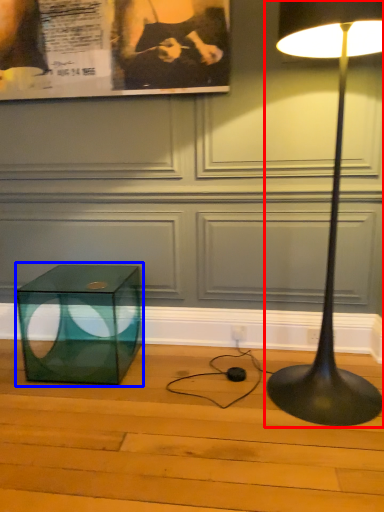
Question: Which of the following is the closest to the observer, lamp (highlighted by a red box) or table (highlighted by a blue box)?

Choices:
 (A) lamp
 (B) table

Answer: (A)